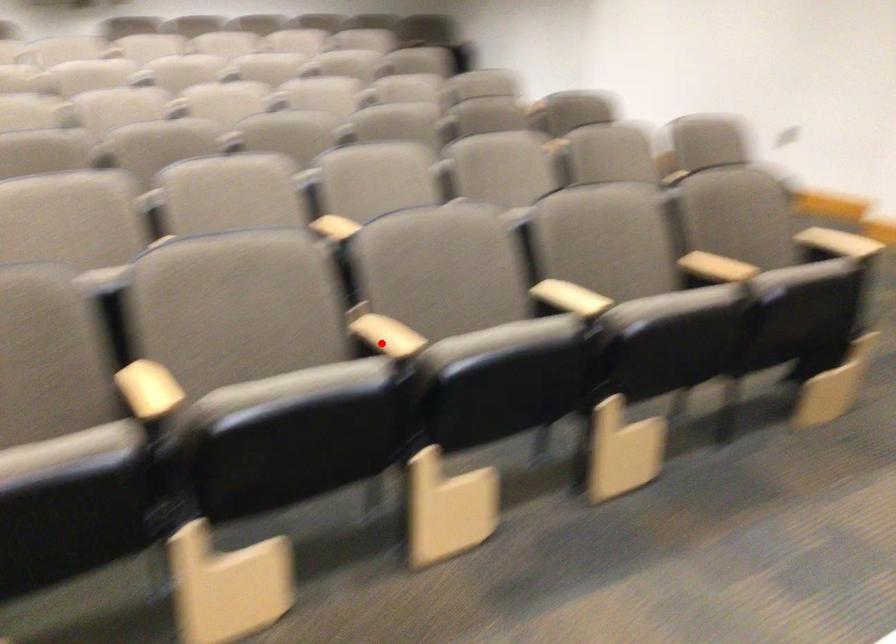
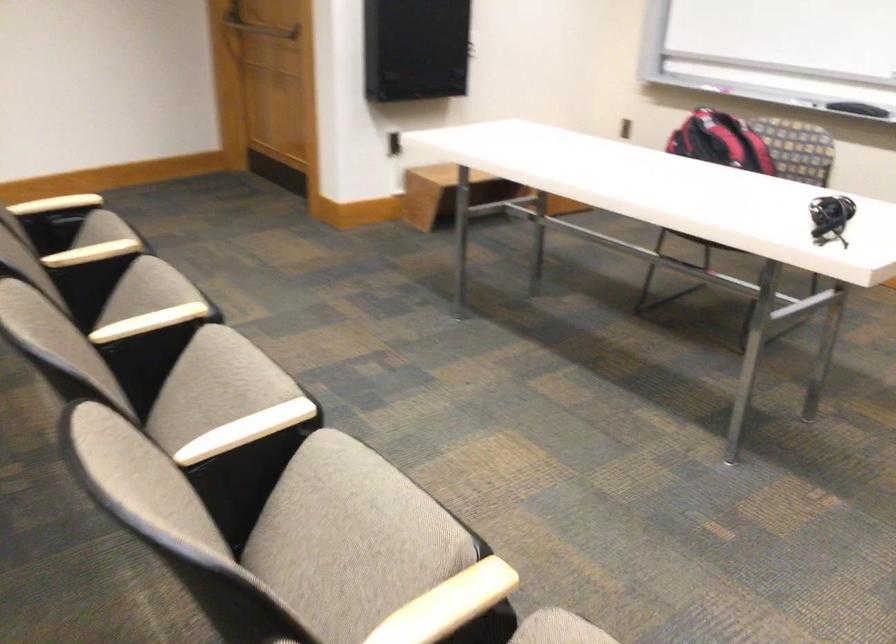
Find the pixel in the second image that matches the highlighted location in the first image.

(245, 430)